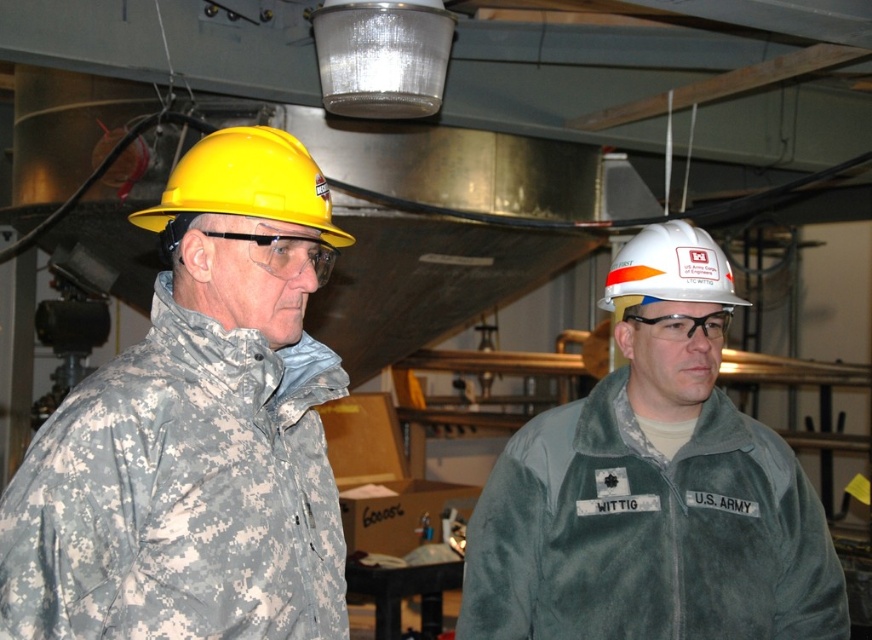
You are an equipment inspector checking the safety gear in the industrial area. You notice the camouflage jacket at left and the yellow hard hat at left. Which item is wider?

The camouflage jacket at left is wider than the yellow hard hat at left.

Based on the scene description, where is the camouflage jacket at left located in terms of its 2D coordinates?

The camouflage jacket at left is located at the 2D coordinates point (196, 429).

You are an inspector in this industrial area. You need to check the safety of the camouflage jacket at left and the white matte helmet at center. Which object is positioned lower in the image?

The camouflage jacket at left is positioned below the white matte helmet at center, so the camouflage jacket at left is lower in the image.